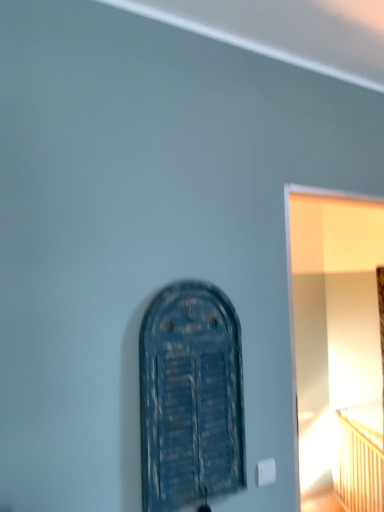
Question: From the image's perspective, would you say white glossy door at right is positioned over blue wooden door at center?

Choices:
 (A) no
 (B) yes

Answer: (A)

Question: Is white glossy door at right at the right side of blue wooden door at center?

Choices:
 (A) no
 (B) yes

Answer: (B)

Question: Can you confirm if white glossy door at right is bigger than blue wooden door at center?

Choices:
 (A) no
 (B) yes

Answer: (B)

Question: From a real-world perspective, is white glossy door at right over blue wooden door at center?

Choices:
 (A) yes
 (B) no

Answer: (B)

Question: Does white glossy door at right have a greater width compared to blue wooden door at center?

Choices:
 (A) yes
 (B) no

Answer: (A)

Question: Is white glossy door at right looking in the opposite direction of blue wooden door at center?

Choices:
 (A) yes
 (B) no

Answer: (B)

Question: Considering the relative positions of blue wooden door at center and wooden bed at right in the image provided, is blue wooden door at center to the right of wooden bed at right from the viewer's perspective?

Choices:
 (A) yes
 (B) no

Answer: (B)

Question: Is blue wooden door at center taller than wooden bed at right?

Choices:
 (A) yes
 (B) no

Answer: (A)

Question: From a real-world perspective, is blue wooden door at center positioned under wooden bed at right based on gravity?

Choices:
 (A) yes
 (B) no

Answer: (B)

Question: From the image's perspective, is blue wooden door at center below wooden bed at right?

Choices:
 (A) no
 (B) yes

Answer: (A)

Question: Is blue wooden door at center oriented towards wooden bed at right?

Choices:
 (A) no
 (B) yes

Answer: (A)

Question: From the image's perspective, is blue wooden door at center above wooden bed at right?

Choices:
 (A) yes
 (B) no

Answer: (A)

Question: Is wooden bed at right behind white glossy door at right?

Choices:
 (A) no
 (B) yes

Answer: (B)